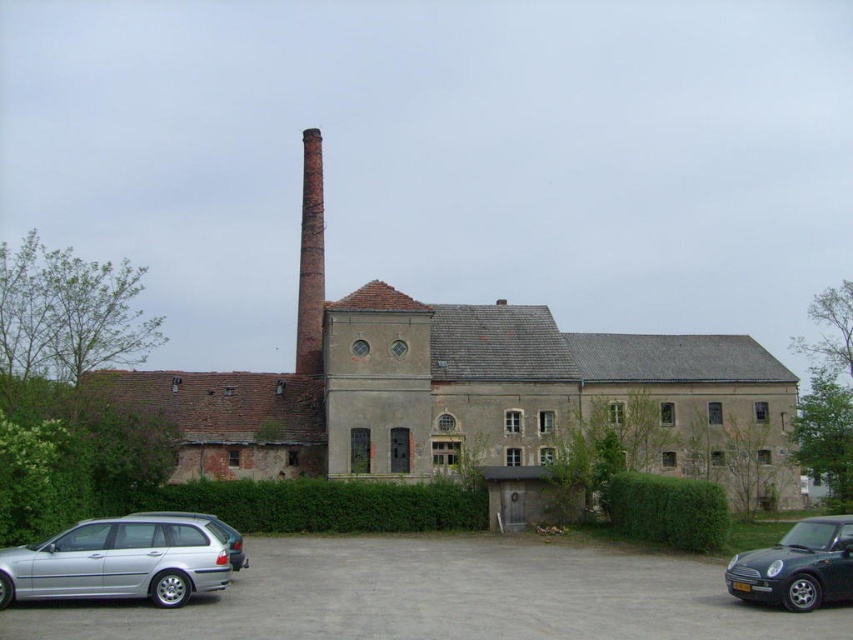
Can you confirm if green leafy hedge at lower center is positioned below red brick chimney at center?

Indeed, green leafy hedge at lower center is positioned under red brick chimney at center.

Between point (659, 502) and point (314, 266), which one is positioned in front?

Positioned in front is point (659, 502).

Where is `green leafy hedge at lower center`? green leafy hedge at lower center is located at coordinates (666, 509).

Does gray concrete parking lot at lower center have a greater width compared to green leafy hedge at lower center?

Indeed, gray concrete parking lot at lower center has a greater width compared to green leafy hedge at lower center.

From the picture: Can you confirm if gray concrete parking lot at lower center is positioned below green leafy hedge at lower center?

Correct, gray concrete parking lot at lower center is located below green leafy hedge at lower center.

Where is `gray concrete parking lot at lower center`? The width and height of the screenshot is (853, 640). gray concrete parking lot at lower center is located at coordinates (444, 596).

Based on the photo, between shiny black car at lower right and red brick chimney at center, which one appears on the right side from the viewer's perspective?

shiny black car at lower right

Does shiny black car at lower right lie behind red brick chimney at center?

No, it is in front of red brick chimney at center.

Identify the location of shiny black car at lower right. The height and width of the screenshot is (640, 853). (798, 566).